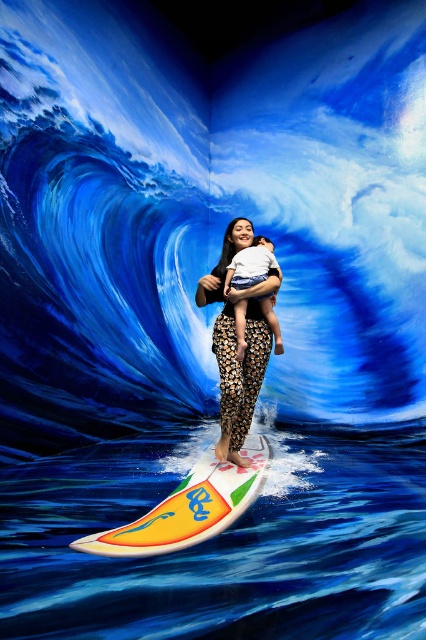
Question: Is yellow-green plastic surfboard at center to the right of leopard print pants at center from the viewer's perspective?

Choices:
 (A) no
 (B) yes

Answer: (A)

Question: Which object is the farthest from the yellow-green plastic surfboard at center?

Choices:
 (A) white cotton shirt at center
 (B) leopard print pants at center

Answer: (A)

Question: Among these points, which one is nearest to the camera?

Choices:
 (A) (253, 241)
 (B) (141, 525)
 (C) (235, 348)

Answer: (B)

Question: Does yellow-green plastic surfboard at center have a larger size compared to white cotton shirt at center?

Choices:
 (A) yes
 (B) no

Answer: (B)

Question: Is yellow-green plastic surfboard at center above leopard print pants at center?

Choices:
 (A) no
 (B) yes

Answer: (A)

Question: Which of the following is the farthest from the observer?

Choices:
 (A) leopard print pants at center
 (B) yellow-green plastic surfboard at center
 (C) white cotton shirt at center

Answer: (C)